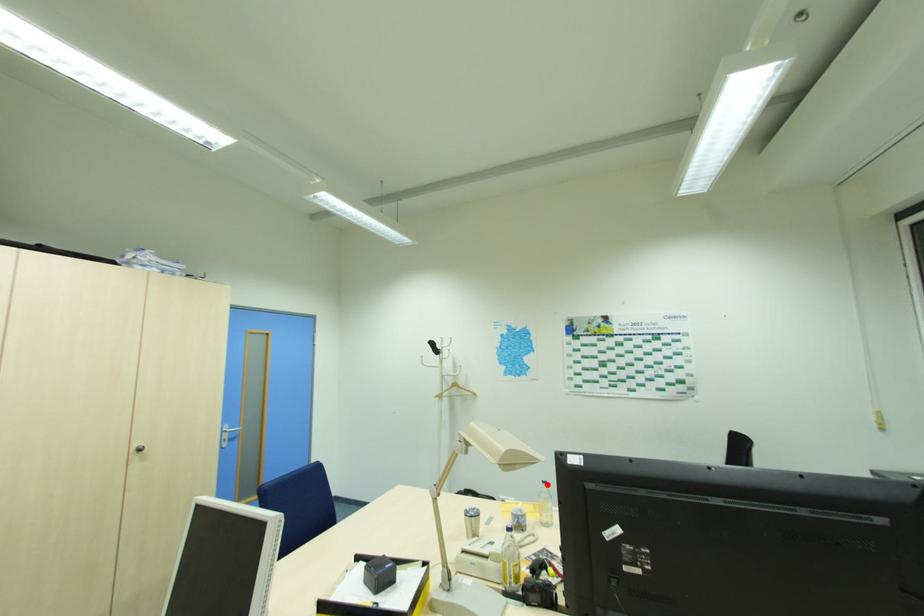
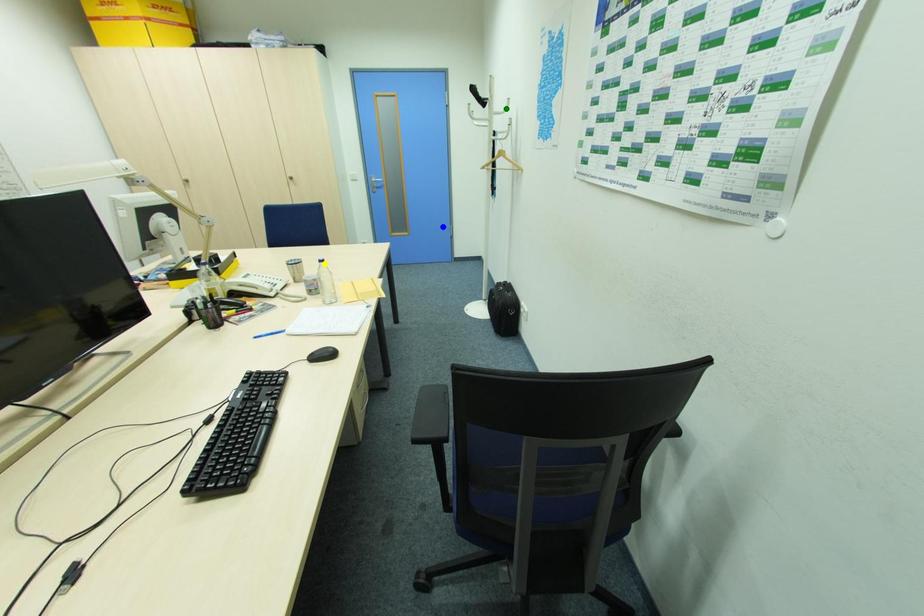
Question: I am providing you with two images of the same scene from different viewpoints. A red point is marked on the first image. You are given multiple points on the second image. Can you choose the point in image 2 that corresponds to the point in image 1?

Choices:
 (A) green point
 (B) blue point
 (C) yellow point

Answer: (C)